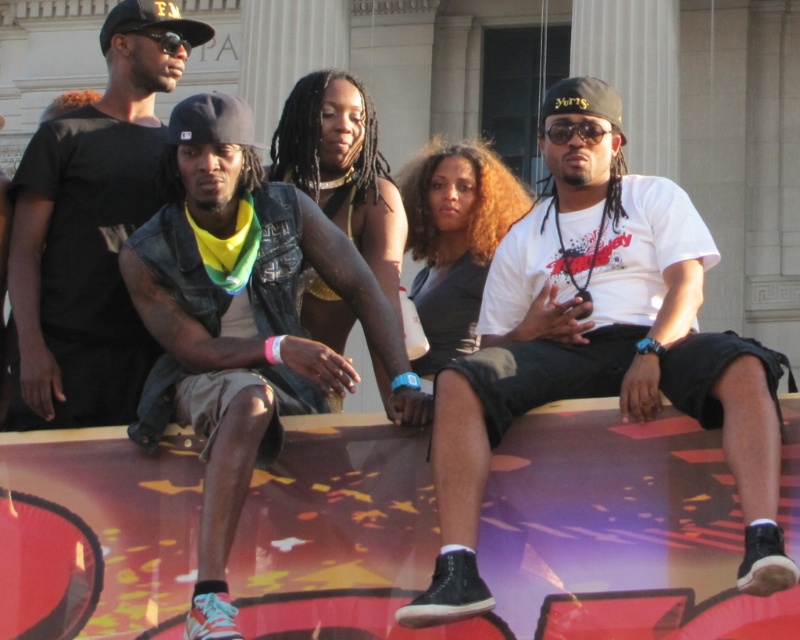
Question: Observing the image, what is the correct spatial positioning of white matte t-shirt at center in reference to black matte t-shirt at upper left?

Choices:
 (A) left
 (B) right

Answer: (B)

Question: Where is white matte t-shirt at center located in relation to black matte t-shirt at upper left in the image?

Choices:
 (A) right
 (B) left

Answer: (A)

Question: Among these objects, which one is nearest to the camera?

Choices:
 (A) denim vest at center
 (B) black matte t-shirt at upper left
 (C) white matte t-shirt at center

Answer: (C)

Question: Is denim vest at center thinner than black matte t-shirt at upper left?

Choices:
 (A) yes
 (B) no

Answer: (B)

Question: Which object appears closest to the camera in this image?

Choices:
 (A) denim vest at center
 (B) black matte t-shirt at upper left
 (C) white matte t-shirt at center

Answer: (C)

Question: Among these objects, which one is farthest from the camera?

Choices:
 (A) white matte t-shirt at center
 (B) black matte t-shirt at upper left
 (C) denim vest at center

Answer: (B)